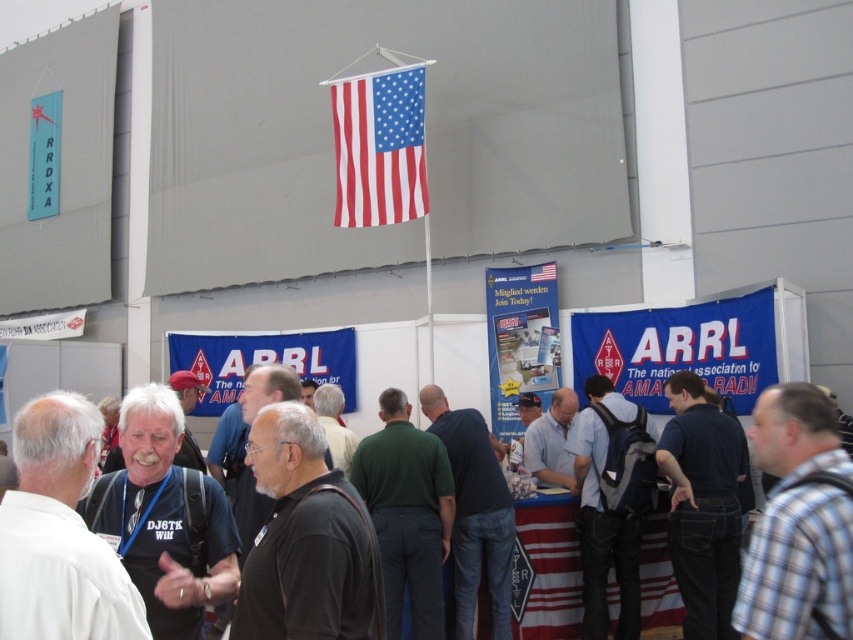
Is plaid fabric shirt at center closer to camera compared to black shirt at center?

Yes, plaid fabric shirt at center is in front of black shirt at center.

How far apart are plaid fabric shirt at center and black shirt at center?

They are 12.28 feet apart.

Is point (821, 406) positioned behind point (247, 467)?

That is False.

The image size is (853, 640). I want to click on plaid fabric shirt at center, so click(x=798, y=522).

Which is below, plaid fabric shirt at center or dark blue shirt at center?

Positioned lower is dark blue shirt at center.

Where is `plaid fabric shirt at center`? The height and width of the screenshot is (640, 853). plaid fabric shirt at center is located at coordinates (798, 522).

Which is more to the left, american flag at upper center or blue fabric banner at center?

From the viewer's perspective, blue fabric banner at center appears more on the left side.

Does american flag at upper center have a larger size compared to blue fabric banner at center?

No, american flag at upper center is not bigger than blue fabric banner at center.

Which is in front, point (374, 108) or point (231, 374)?

Positioned in front is point (374, 108).

Where is `american flag at upper center`? Image resolution: width=853 pixels, height=640 pixels. american flag at upper center is located at coordinates (379, 147).